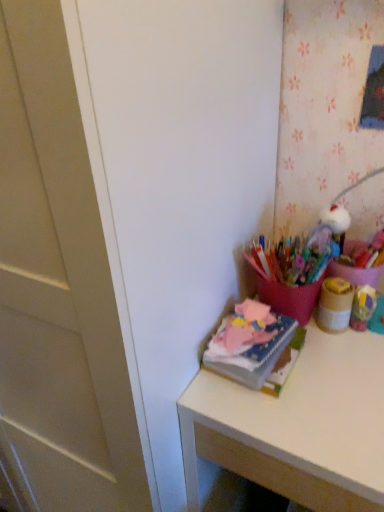
The height and width of the screenshot is (512, 384). Find the location of `free space above matte pink desk at right (from a real-world perspective)`. free space above matte pink desk at right (from a real-world perspective) is located at coordinates (326, 376).